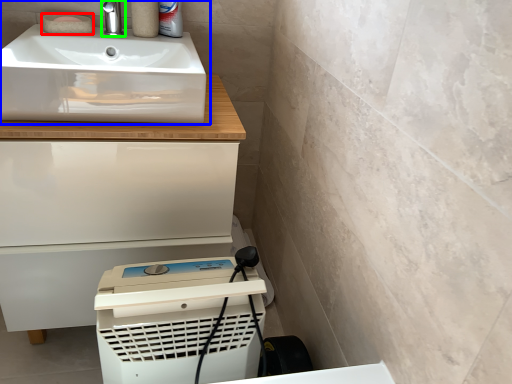
Question: Which is farther away from soap (highlighted by a red box)? sink (highlighted by a blue box) or tap (highlighted by a green box)?

Choices:
 (A) sink
 (B) tap

Answer: (A)